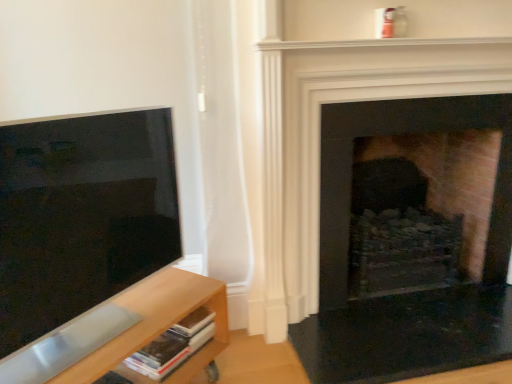
What are the coordinates of `vacant area on top of light wood shelf at lower left (from a real-world perspective)` in the screenshot? It's located at (124, 319).